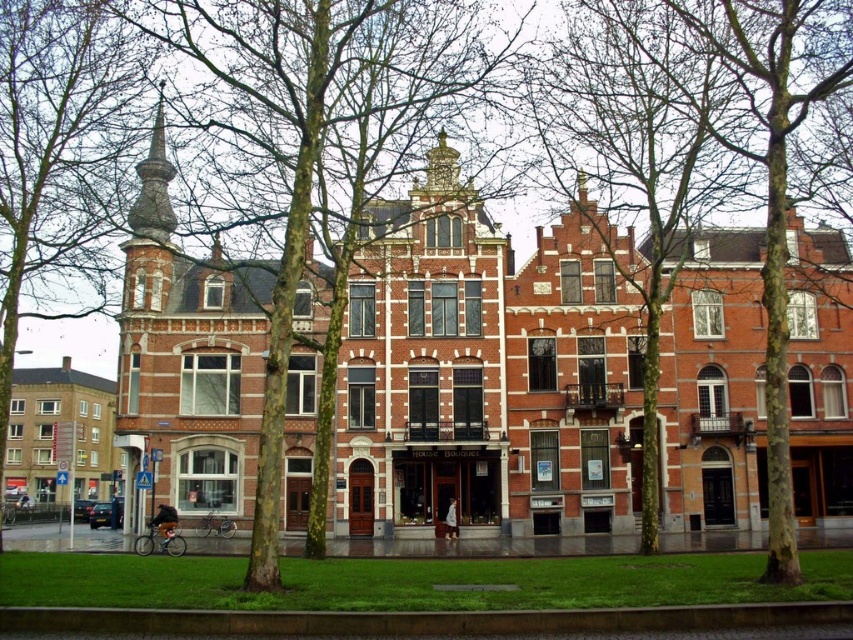
Is smooth bark tree at center to the right of smooth bark tree at left from the viewer's perspective?

Correct, you'll find smooth bark tree at center to the right of smooth bark tree at left.

At what (x,y) coordinates should I click in order to perform the action: click on smooth bark tree at center. Please return your answer as a coordinate pair (x, y). Looking at the image, I should click on (639, 154).

Does point (610, 202) come farther from viewer compared to point (102, 97)?

That is True.

Identify the location of smooth bark tree at center. (639, 154).

Is green leafy tree at center shorter than smooth bark tree at left?

In fact, green leafy tree at center may be taller than smooth bark tree at left.

Consider the image. Can you confirm if green leafy tree at center is positioned to the right of smooth bark tree at left?

Correct, you'll find green leafy tree at center to the right of smooth bark tree at left.

Which is behind, point (207, 192) or point (68, 232)?

Point (68, 232)

I want to click on green leafy tree at center, so click(312, 141).

In the scene shown: Can you confirm if green leafy tree at center is thinner than smooth bark tree at center?

No, green leafy tree at center is not thinner than smooth bark tree at center.

Does point (224, 189) lie behind point (694, 74)?

Yes, point (224, 189) is farther from viewer.

Find the location of `green leafy tree at center`. green leafy tree at center is located at coordinates (312, 141).